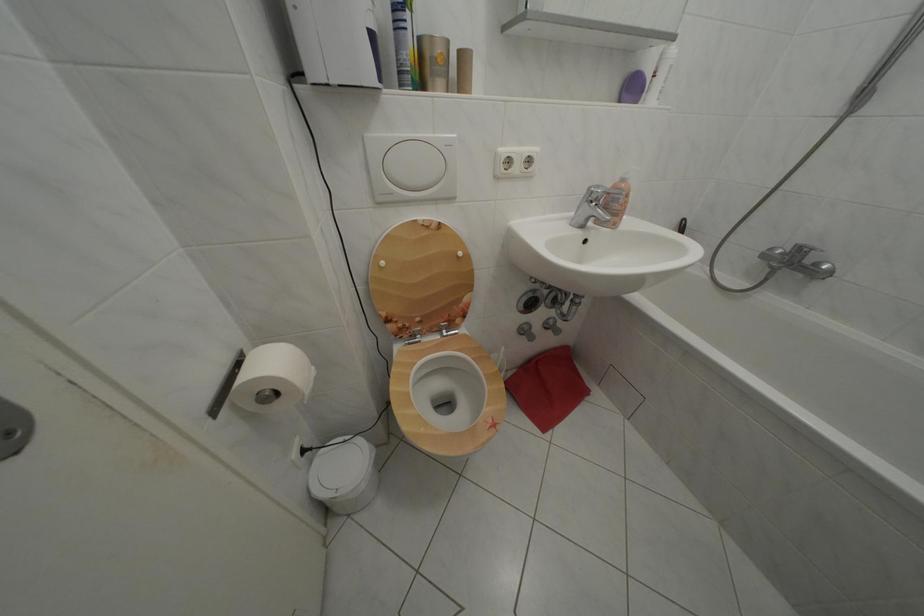
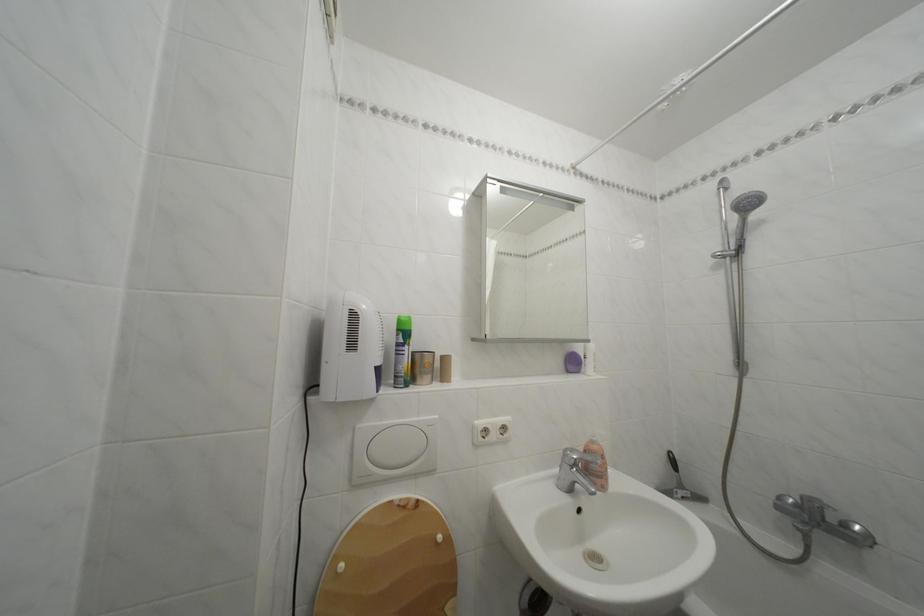
Locate, in the second image, the point that corresponds to (x=608, y=193) in the first image.

(581, 456)